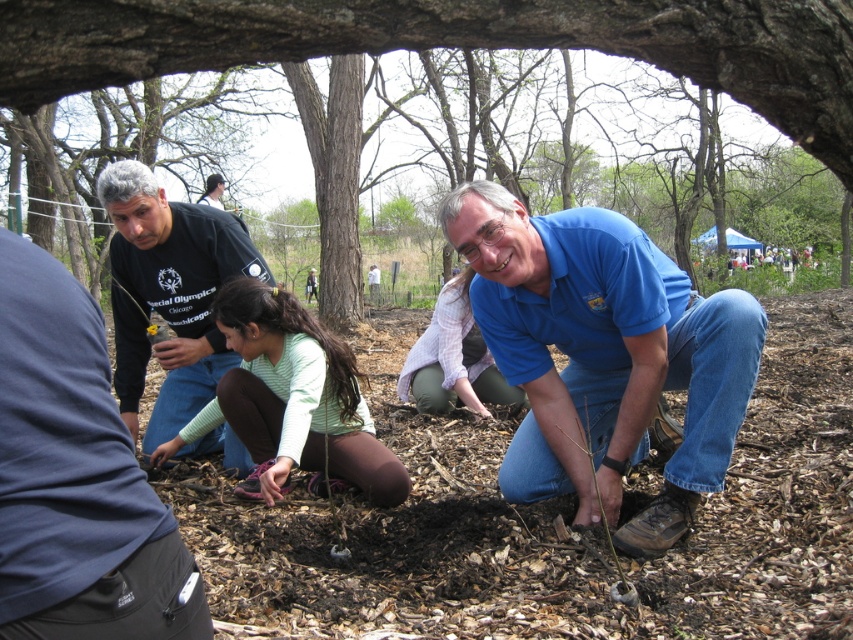
You are a landscape architect designing a garden. You need to place a 2.5 meter wide decorative stone path between the brown mulch at center and the light purple shirt at center. Is there enough space for the path?

The distance between the brown mulch at center and the light purple shirt at center is 3.01 meters. Since the path requires 2.5 meters, there is sufficient space as 3.01 meters is greater than 2.5 meters.

You are a photographer trying to capture a closeup of the person in the light green long sleeve shirt and dark pants who is kneeling. You are currently positioned at point A, which is located at point (532,353). There is an obstacle at point B, which is located at point (805,106). Can you move closer to the kneeling person without going past point B?

Point (532,353) is further to the camera than point (805,106). Since point B is closer to the kneeling person than point A, you can move from point A towards point B to get closer without passing point B.

You are organizing a tree planting event and need to ensure there is enough mulch to cover the planting area. Given the brown mulch at center and the light purple shirt at center, which object takes up more space in the scene?

The light purple shirt at center occupies more space than the brown mulch at center.